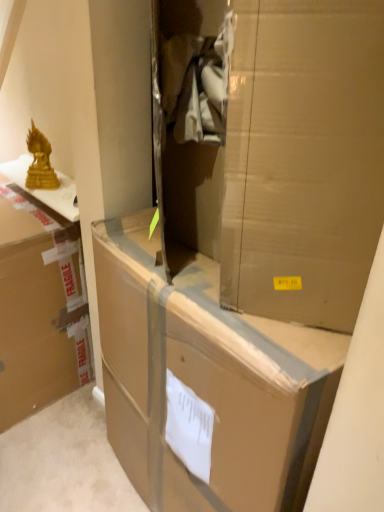
Question: Is brown cardboard box at left, positioned as the first box in left-to-right order, positioned far away from cardboard box at center, which is counted as the second box, starting from the left?

Choices:
 (A) yes
 (B) no

Answer: (B)

Question: Can you confirm if brown cardboard box at left, the second box when ordered from right to left, is shorter than cardboard box at center, the first box from the right?

Choices:
 (A) no
 (B) yes

Answer: (B)

Question: Could you tell me if brown cardboard box at left, the second box when ordered from right to left, is turned towards cardboard box at center, which is counted as the second box, starting from the left?

Choices:
 (A) no
 (B) yes

Answer: (A)

Question: Is brown cardboard box at left, the second box when ordered from right to left, smaller than cardboard box at center, which is counted as the second box, starting from the left?

Choices:
 (A) yes
 (B) no

Answer: (A)

Question: From a real-world perspective, is brown cardboard box at left, the second box when ordered from right to left, on top of cardboard box at center, the first box from the right?

Choices:
 (A) no
 (B) yes

Answer: (A)

Question: Can you confirm if brown cardboard box at left, the second box when ordered from right to left, is thinner than cardboard box at center, which is counted as the second box, starting from the left?

Choices:
 (A) yes
 (B) no

Answer: (A)

Question: From a real-world perspective, is gold metallic statue at upper left beneath brown cardboard box at center?

Choices:
 (A) yes
 (B) no

Answer: (A)

Question: Is gold metallic statue at upper left behind brown cardboard box at center?

Choices:
 (A) no
 (B) yes

Answer: (B)

Question: From the image's perspective, is gold metallic statue at upper left on brown cardboard box at center?

Choices:
 (A) yes
 (B) no

Answer: (A)

Question: Is the position of gold metallic statue at upper left less distant than that of brown cardboard box at center?

Choices:
 (A) yes
 (B) no

Answer: (B)

Question: Is brown cardboard box at center at the back of gold metallic statue at upper left?

Choices:
 (A) yes
 (B) no

Answer: (B)

Question: Is gold metallic statue at upper left in contact with brown cardboard box at center?

Choices:
 (A) yes
 (B) no

Answer: (B)

Question: Is gold metallic statue at upper left outside of cardboard box at center, which is counted as the second box, starting from the left?

Choices:
 (A) no
 (B) yes

Answer: (B)